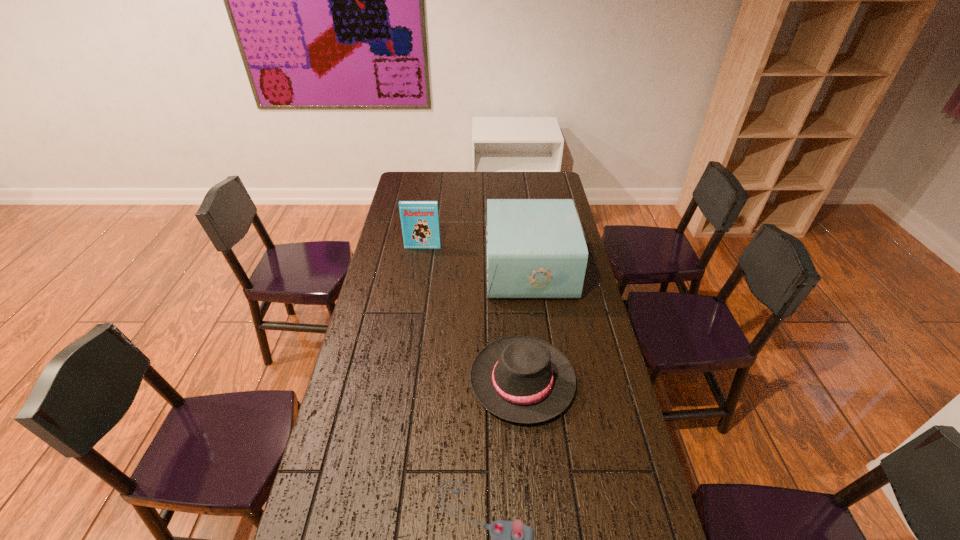
Where is `free space between the book and the radio receiver`? The image size is (960, 540). free space between the book and the radio receiver is located at coordinates (476, 258).

At what (x,y) coordinates should I click in order to perform the action: click on object that is the third closest to the dress hat. Please return your answer as a coordinate pair (x, y). The width and height of the screenshot is (960, 540). Looking at the image, I should click on (419, 219).

The width and height of the screenshot is (960, 540). What are the coordinates of `object that is the third closest one to the radio receiver` in the screenshot? It's located at (511, 539).

Where is `free space that satisfies the following two spatial constraints: 1. on the front cover of the leftmost object; 2. on the right side of the second nearest object`? free space that satisfies the following two spatial constraints: 1. on the front cover of the leftmost object; 2. on the right side of the second nearest object is located at coordinates (401, 381).

What are the coordinates of `blank space that satisfies the following two spatial constraints: 1. on the front panel of the radio receiver; 2. on the front side of the third farthest object` in the screenshot? It's located at (543, 381).